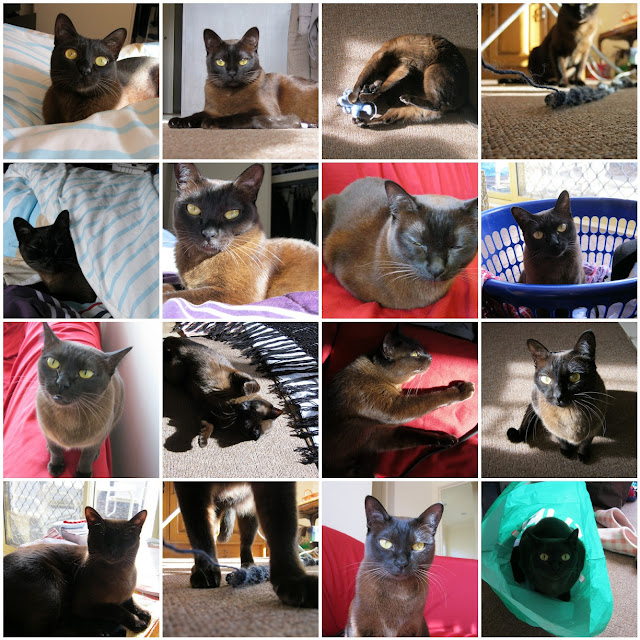
Find the location of a particular element. The width and height of the screenshot is (640, 640). blanket is located at coordinates (35, 132), (118, 221).